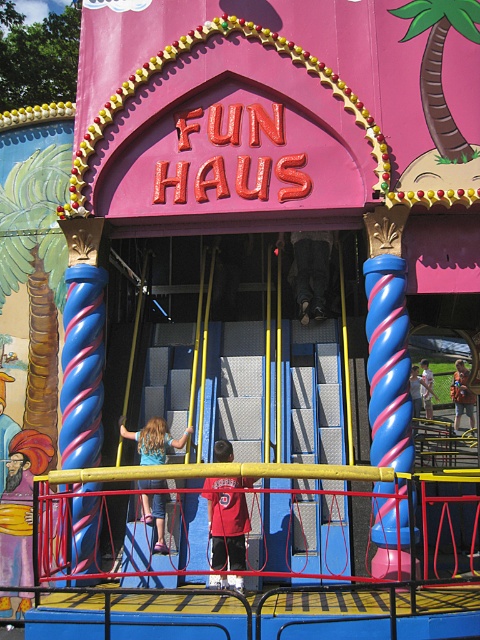
Question: Which point is closer to the camera?

Choices:
 (A) (146, 496)
 (B) (248, 515)

Answer: (B)

Question: Which object is closer to the camera taking this photo?

Choices:
 (A) red shirt at center
 (B) blue denim shorts at center

Answer: (A)

Question: Is red shirt at center behind blue denim shorts at center?

Choices:
 (A) yes
 (B) no

Answer: (B)

Question: Can you confirm if red shirt at center is bigger than blue denim shorts at center?

Choices:
 (A) no
 (B) yes

Answer: (A)

Question: Is red shirt at center to the left of blue denim shorts at center from the viewer's perspective?

Choices:
 (A) no
 (B) yes

Answer: (A)